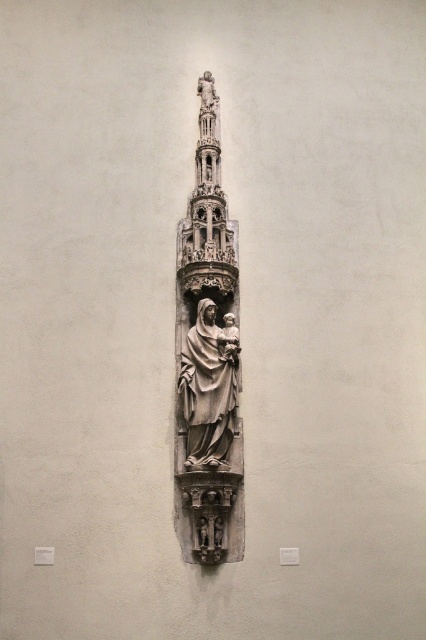
Question: Which of the following is the farthest from the observer?

Choices:
 (A) matte gray statue at center
 (B) stone statue at center

Answer: (B)

Question: Observing the image, what is the correct spatial positioning of stone statue at center in reference to matte gray statue at center?

Choices:
 (A) below
 (B) above

Answer: (B)

Question: Does stone statue at center come behind matte gray statue at center?

Choices:
 (A) no
 (B) yes

Answer: (B)

Question: Observing the image, what is the correct spatial positioning of stone statue at center in reference to matte gray statue at center?

Choices:
 (A) left
 (B) right

Answer: (A)

Question: Among these objects, which one is farthest from the camera?

Choices:
 (A) stone statue at center
 (B) matte gray statue at center

Answer: (A)